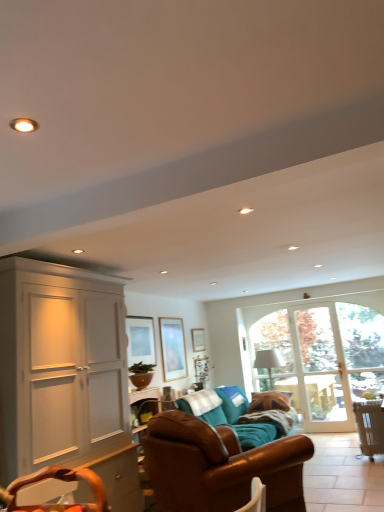
Question: In the image, is wooden picture frame at center, the 3th picture frame in the left-to-right sequence, positioned in front of or behind brown leather chair at lower right?

Choices:
 (A) front
 (B) behind

Answer: (B)

Question: Is wooden picture frame at center, the 3th picture frame from the front, inside the boundaries of brown leather chair at lower right, or outside?

Choices:
 (A) inside
 (B) outside

Answer: (B)

Question: Considering the real-world distances, which object is farthest from the white matte cabinet at left?

Choices:
 (A) brown leather chair at lower right
 (B) clear glass door at right
 (C) wooden picture frame at center, the 3th picture frame from the front
 (D) matte glass picture frame at center, the 1th picture frame in the front-to-back sequence
 (E) clear glass door at right

Answer: (E)

Question: Which is nearer to the brown leather couch at center, marked as the 1th studio couch in a back-to-front arrangement?

Choices:
 (A) brown leather couch at center, the 2th studio couch in the back-to-front sequence
 (B) matte wooden picture frame at center, which is counted as the second picture frame, starting from the back
 (C) white matte cabinet at left
 (D) matte glass picture frame at center, arranged as the third picture frame when viewed from the back
 (E) brown leather swivel chair at lower left

Answer: (B)